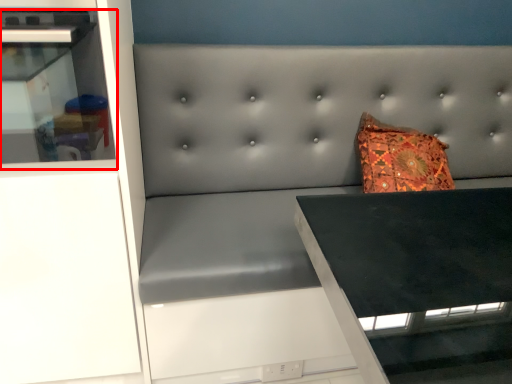
Question: Considering the relative positions of shelf (annotated by the red box) and cabinetry in the image provided, where is shelf (annotated by the red box) located with respect to the staircase?

Choices:
 (A) right
 (B) left

Answer: (A)